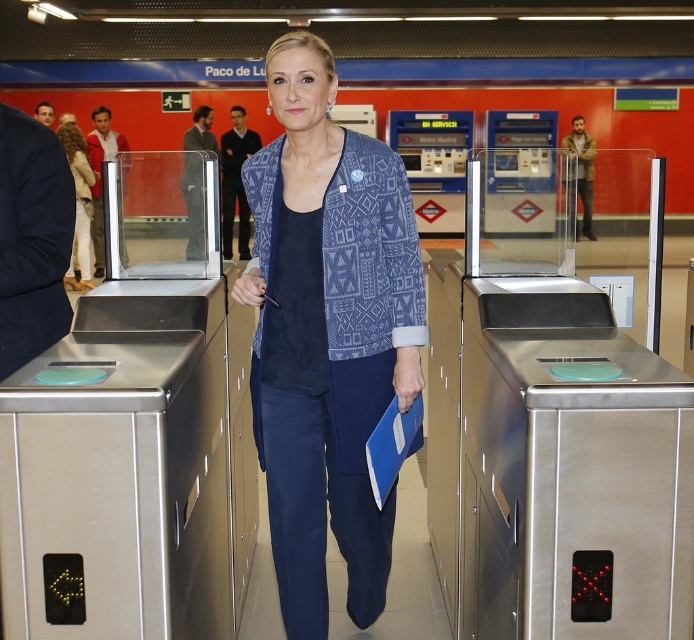
Does blue printed blazer at center have a larger size compared to light brown leather jacket at upper left?

No.

Who is more distant from viewer, (291, 324) or (78, 276)?

Point (78, 276)

What do you see at coordinates (328, 333) in the screenshot? I see `blue printed blazer at center` at bounding box center [328, 333].

Image resolution: width=694 pixels, height=640 pixels. I want to click on blue printed blazer at center, so click(328, 333).